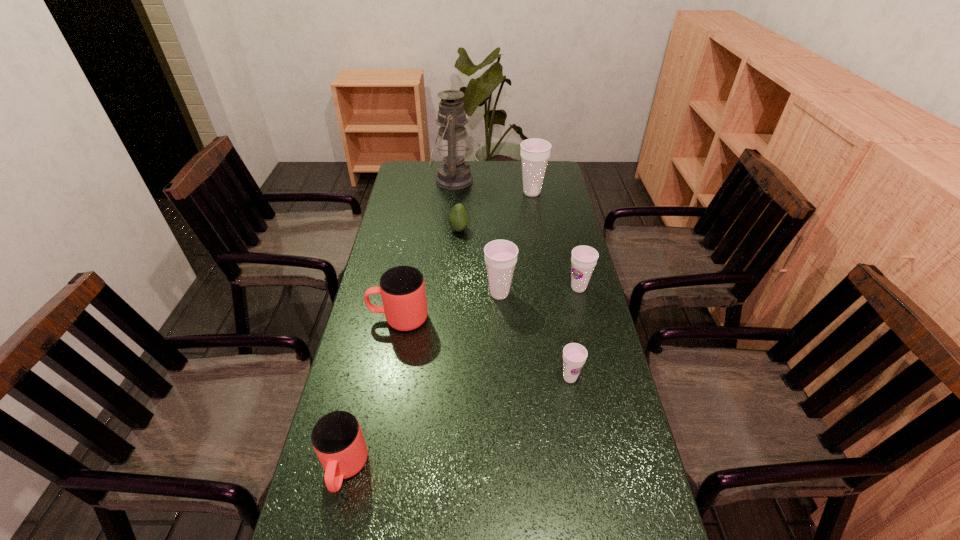
Where is `oil lamp`? The width and height of the screenshot is (960, 540). oil lamp is located at coordinates (454, 173).

This screenshot has height=540, width=960. I want to click on the farthest purple cup, so click(x=535, y=153).

You are a GUI agent. You are given a task and a screenshot of the screen. Output one action in this format:
    pyautogui.click(x=<x>, y=<y>)
    Task: Click on the biggest purple cup
    Image resolution: width=960 pixels, height=540 pixels.
    Given the screenshot: What is the action you would take?
    pyautogui.click(x=535, y=153)

Identify the location of the second biggest purple cup. The image size is (960, 540). (500, 255).

At what (x,y) coordinates should I click in order to perform the action: click on the leftmost purple cup. Please return your answer as a coordinate pair (x, y). The image size is (960, 540). Looking at the image, I should click on [500, 255].

Locate an element on the screen. the farther pink cup is located at coordinates (402, 288).

Where is `the second smallest purple cup`? The height and width of the screenshot is (540, 960). the second smallest purple cup is located at coordinates (584, 258).

At what (x,y) coordinates should I click in order to perform the action: click on the nearest object. Please return your answer as a coordinate pair (x, y). The width and height of the screenshot is (960, 540). Looking at the image, I should click on (337, 439).

The width and height of the screenshot is (960, 540). Identify the location of the smaller pink cup. (337, 439).

This screenshot has width=960, height=540. Identify the location of green avocado. (458, 219).